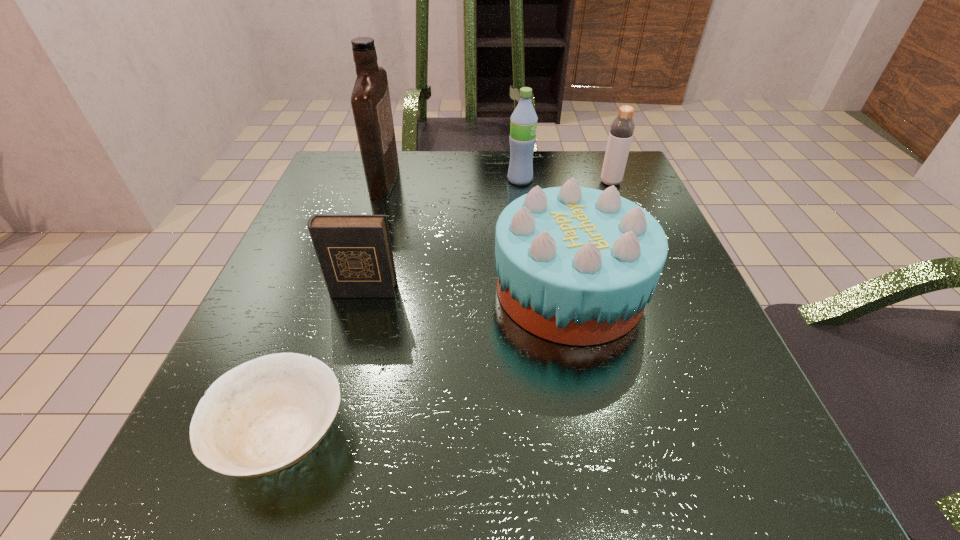
In order to click on the third closest object to the diary in this screenshot , I will do `click(370, 100)`.

This screenshot has width=960, height=540. Find the location of `free point that satisfies the following two spatial constraints: 1. on the label side of the liquor; 2. on the back side of the bottle`. free point that satisfies the following two spatial constraints: 1. on the label side of the liquor; 2. on the back side of the bottle is located at coordinates point(384,183).

Locate an element on the screen. This screenshot has height=540, width=960. vacant space that satisfies the following two spatial constraints: 1. on the label side of the tallest object; 2. on the back side of the second tallest object is located at coordinates (384, 180).